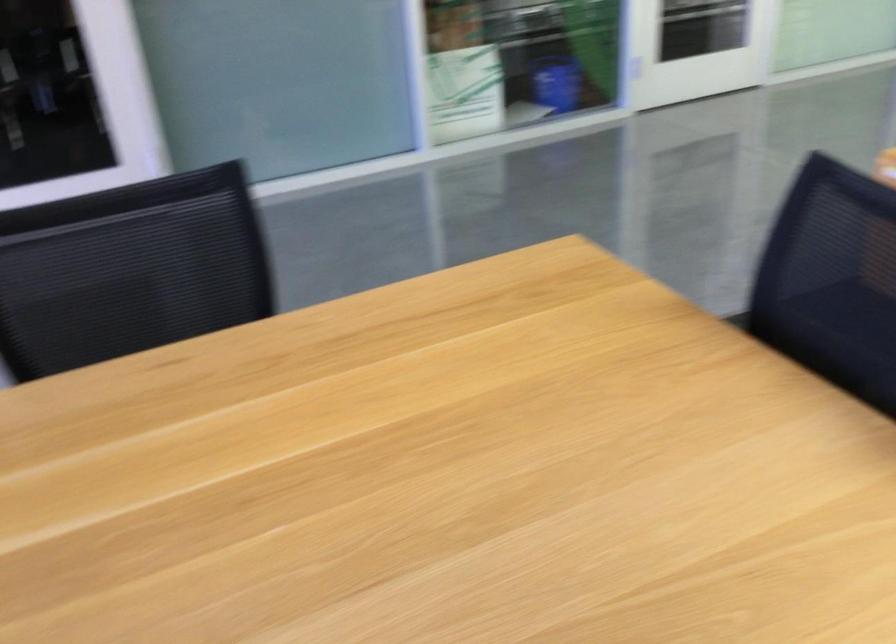
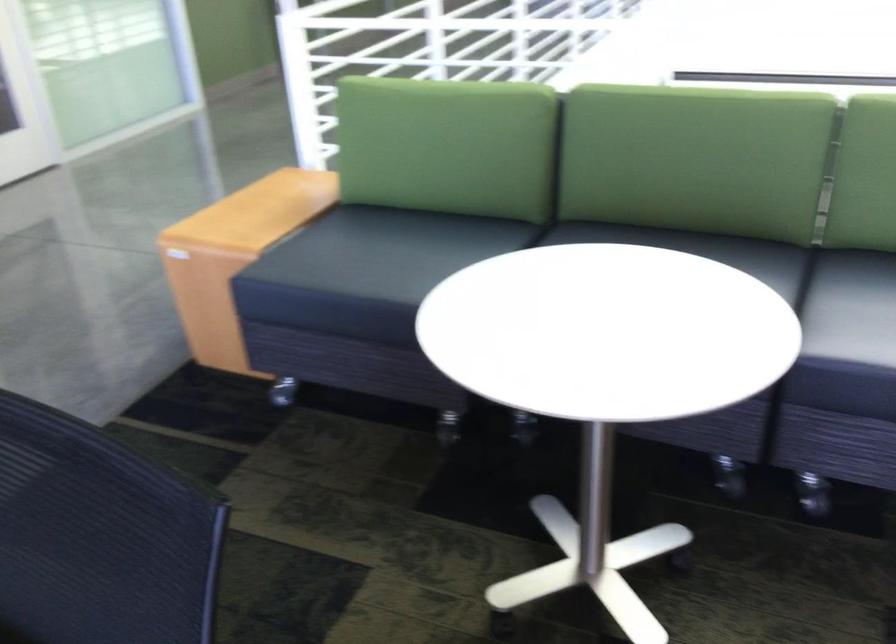
Question: The camera is either moving clockwise (left) or counter-clockwise (right) around the object. The first image is from the beginning of the video and the second image is from the end. Is the camera moving left or right when shooting the video?

Choices:
 (A) Left
 (B) Right

Answer: (A)